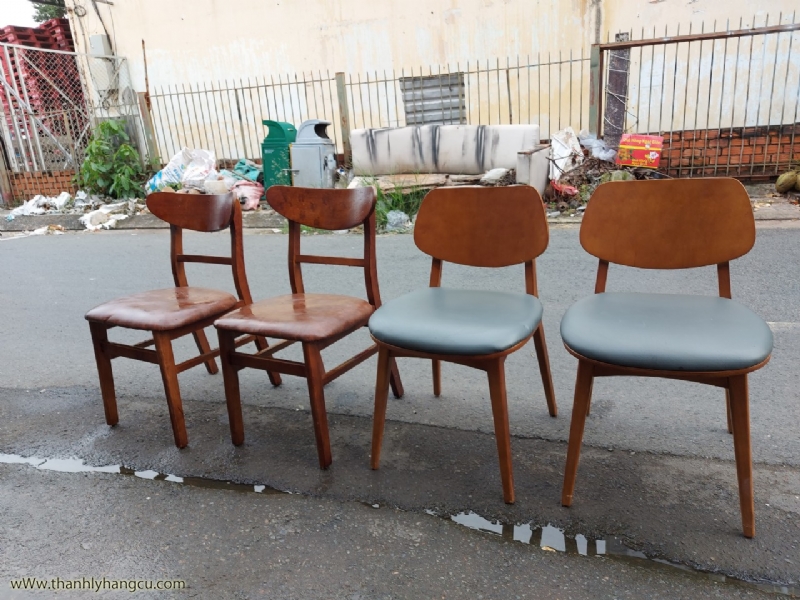
I want to click on backs of the chairs, so click(202, 213), click(334, 211), click(462, 229), click(658, 216).